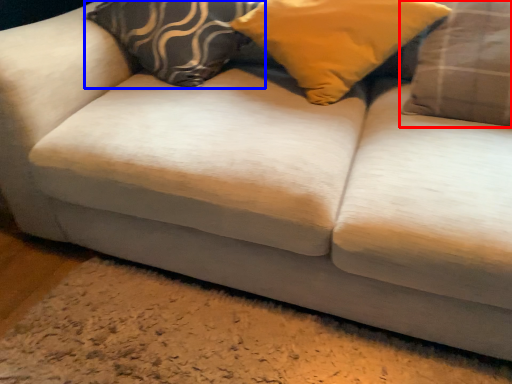
Question: Which object appears closest to the camera in this image, pillow (highlighted by a red box) or pillow (highlighted by a blue box)?

Choices:
 (A) pillow
 (B) pillow

Answer: (A)